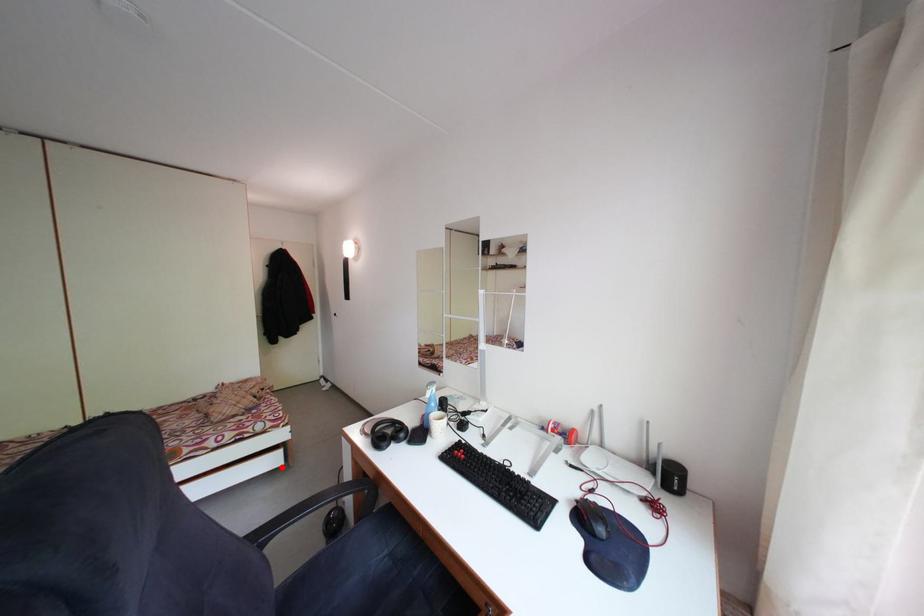
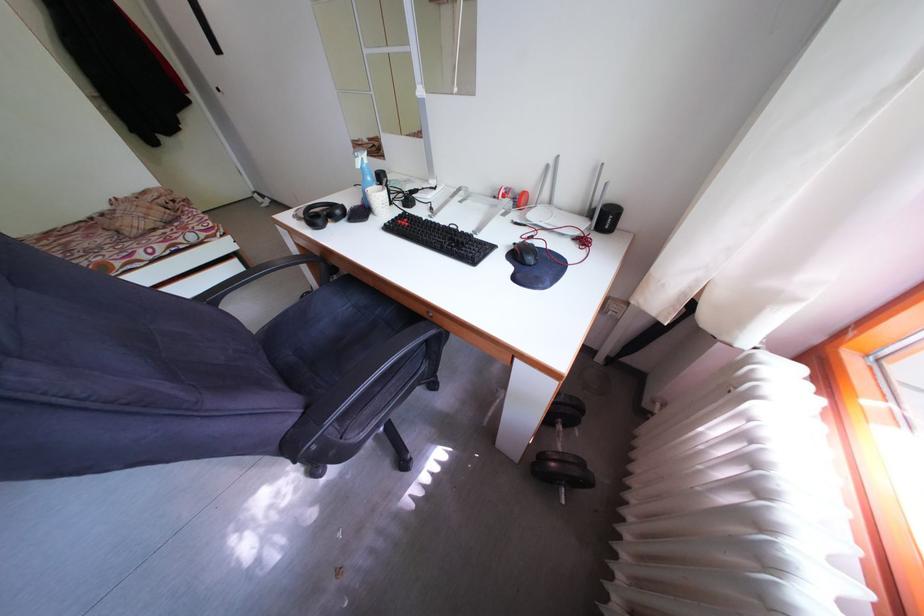
Locate, in the second image, the point that corresponds to the highlighted location in the first image.

(241, 276)